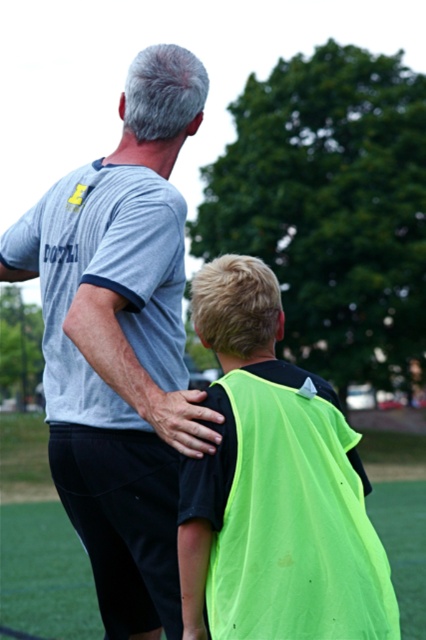
Locate an element on the screen. The image size is (426, 640). gray cotton t-shirt at upper left is located at coordinates (121, 342).

Can you confirm if gray cotton t-shirt at upper left is positioned to the left of neon yellow vest at center?

Correct, you'll find gray cotton t-shirt at upper left to the left of neon yellow vest at center.

Which is behind, point (77, 284) or point (290, 397)?

The point (77, 284) is behind.

Locate an element on the screen. This screenshot has height=640, width=426. gray cotton t-shirt at upper left is located at coordinates (121, 342).

Does neon yellow vest at center lie in front of neon green fabric at center?

That is True.

Is neon yellow vest at center shorter than neon green fabric at center?

Correct, neon yellow vest at center is not as tall as neon green fabric at center.

The width and height of the screenshot is (426, 640). I want to click on neon yellow vest at center, so click(275, 486).

Does gray cotton t-shirt at upper left appear under neon green fabric at center?

Actually, gray cotton t-shirt at upper left is above neon green fabric at center.

Who is taller, gray cotton t-shirt at upper left or neon green fabric at center?

gray cotton t-shirt at upper left

Does point (175, 273) lie in front of point (55, 552)?

Yes, it is in front of point (55, 552).

At what (x,y) coordinates should I click in order to perform the action: click on gray cotton t-shirt at upper left. Please return your answer as a coordinate pair (x, y). The height and width of the screenshot is (640, 426). Looking at the image, I should click on (121, 342).